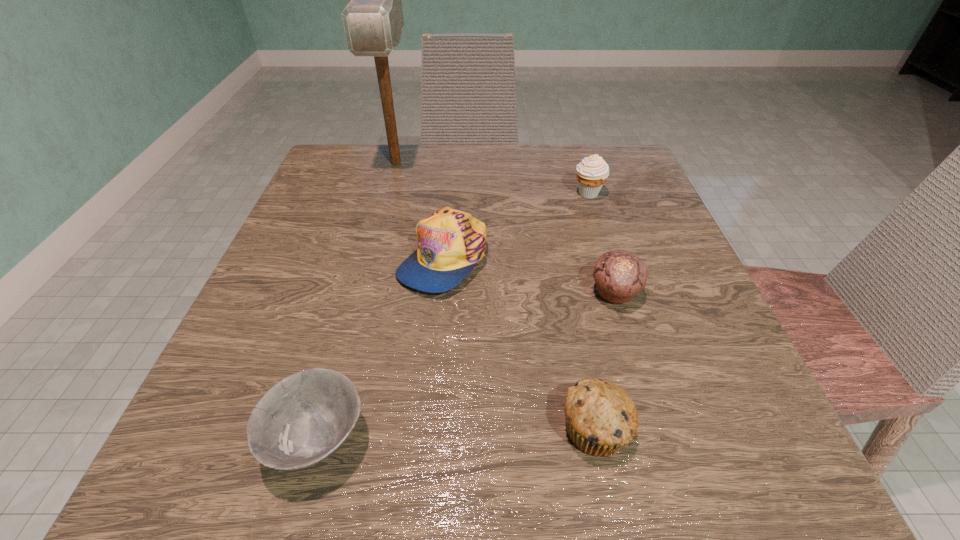
You are a GUI agent. You are given a task and a screenshot of the screen. Output one action in this format:
    pyautogui.click(x=<x>, y=<y>)
    Task: Click on the vacant area that lies between the fifth nearest object and the second nearest muffin
    The width and height of the screenshot is (960, 540).
    Given the screenshot: What is the action you would take?
    pyautogui.click(x=602, y=243)

At what (x,y) coordinates should I click in order to perform the action: click on vacant area between the farthest object and the nearest muffin. Please return your answer as a coordinate pair (x, y). Looking at the image, I should click on (495, 296).

Locate an element on the screen. This screenshot has width=960, height=540. vacant area that lies between the fifth nearest object and the nearest muffin is located at coordinates (591, 311).

You are a GUI agent. You are given a task and a screenshot of the screen. Output one action in this format:
    pyautogui.click(x=<x>, y=<y>)
    Task: Click on the free space between the bowl and the tallest object
    
    Given the screenshot: What is the action you would take?
    click(x=357, y=301)

Find the location of a particular element. The image size is (960, 540). empty space between the nearest muffin and the second farthest object is located at coordinates [591, 311].

This screenshot has height=540, width=960. Identify the location of free spot between the second farthest object and the cap. (516, 226).

This screenshot has height=540, width=960. Identify the location of vacant point located between the farthest muffin and the farthest object. (x=492, y=178).

The height and width of the screenshot is (540, 960). I want to click on free space between the cap and the nearest muffin, so click(519, 344).

Identify the location of blank region between the farthest muffin and the nearest muffin. Image resolution: width=960 pixels, height=540 pixels. (591, 311).

This screenshot has width=960, height=540. Find the location of `object that ranks as the fifth closest to the nearest muffin`. object that ranks as the fifth closest to the nearest muffin is located at coordinates (373, 20).